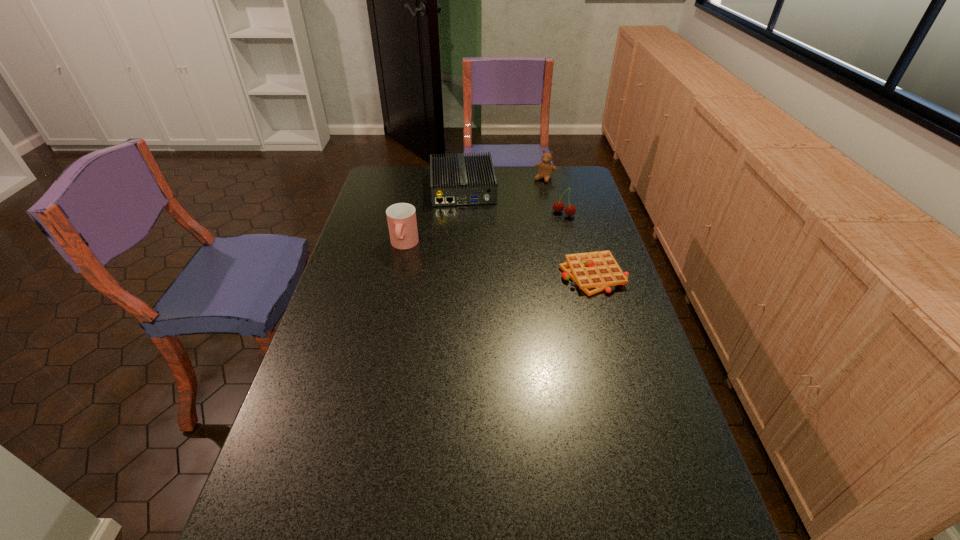
At what (x,y) coordinates should I click in order to perform the action: click on free area in between the cherry and the teddy bear. Please return your answer as a coordinate pair (x, y). The width and height of the screenshot is (960, 540). Looking at the image, I should click on (554, 196).

Identify the location of vacant space that is in between the cherry and the waffle. (579, 244).

The width and height of the screenshot is (960, 540). I want to click on empty space that is in between the leftmost object and the waffle, so click(x=499, y=260).

This screenshot has width=960, height=540. In order to click on free space between the cherry and the teddy bear in this screenshot , I will do `click(554, 196)`.

Find the location of a particular element. free space between the cup and the teddy bear is located at coordinates (474, 212).

Identify the location of vacant area that lies between the cherry and the waffle. (579, 244).

The width and height of the screenshot is (960, 540). What are the coordinates of `free point between the shortest object and the second object from left to right` in the screenshot? It's located at (528, 232).

Find the location of `vacant region between the cherry and the leftmost object`. vacant region between the cherry and the leftmost object is located at coordinates (484, 230).

Find the location of a particular element. This screenshot has height=540, width=960. object that is the fourth closest one to the cherry is located at coordinates (401, 217).

Select which object is the second closest to the cherry. Please provide its 2D coordinates. Your answer should be formatted as a tuple, i.e. [(x, y)], where the tuple contains the x and y coordinates of a point satisfying the conditions above.

[(461, 180)]